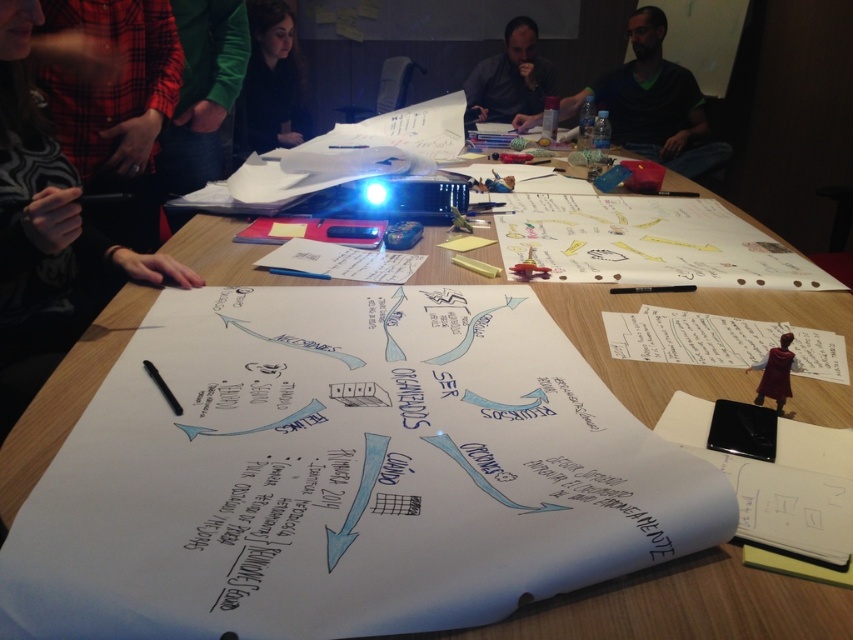
You are at the brainstorming table and need to place a new sticky note. Where should you put it to avoid covering the plaid fabric shirt at upper left?

Place the sticky note somewhere other than the coordinates where the plaid fabric shirt at upper left is located, which is at point (112, 102).

You are a photographer trying to capture a closeup of the handwritten text on the large sheet of paper at the center of the table. There are two people in your way, wearing a plaid fabric shirt at upper left and a dark gray shirt at center. Which shirt should you move to get a clear shot of the text?

The plaid fabric shirt at upper left is smaller than the dark gray shirt at center, so moving the plaid fabric shirt at upper left would be more effective to clear the path for the photographer to capture the text.